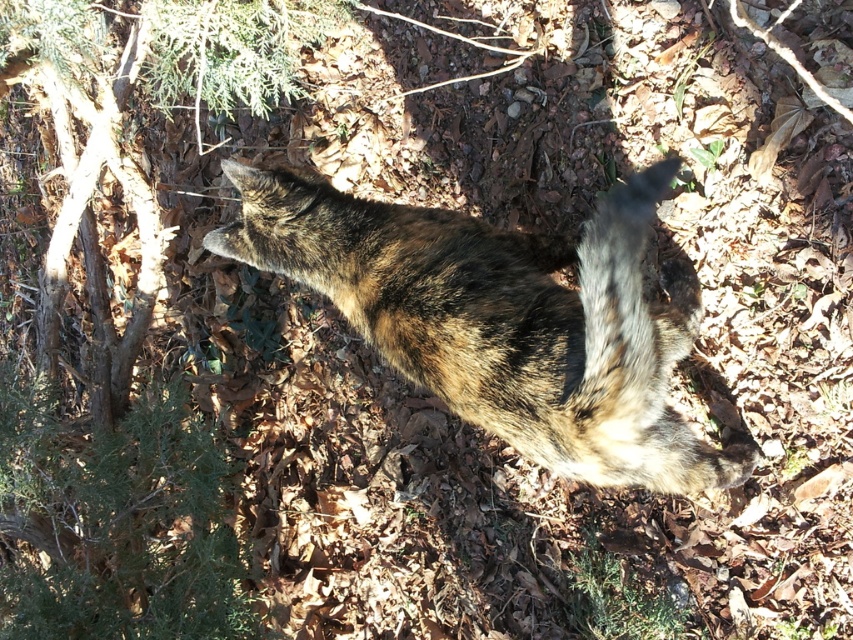
You are a photographer trying to capture the tabby fur cat at center and the brown fur tail at center in a single shot. Which object is closer to you, the photographer?

The tabby fur cat at center is closer to you than the brown fur tail at center, so the cat will appear more prominent in your photo.

You are a photographer trying to capture the tabby fur cat at center. You notice the green textured tree at upper left might block your view. Can you see the cat clearly from your current position?

The tabby fur cat at center is behind the green textured tree at upper left, so the tree would block your view of the cat.

You are a bird flying near a forest. You see a green textured tree at upper left and a tabby fur cat at center. Which object is positioned higher in the sky?

The tabby fur cat at center is positioned higher in the sky than the green textured tree at upper left because the tree is located below the cat.